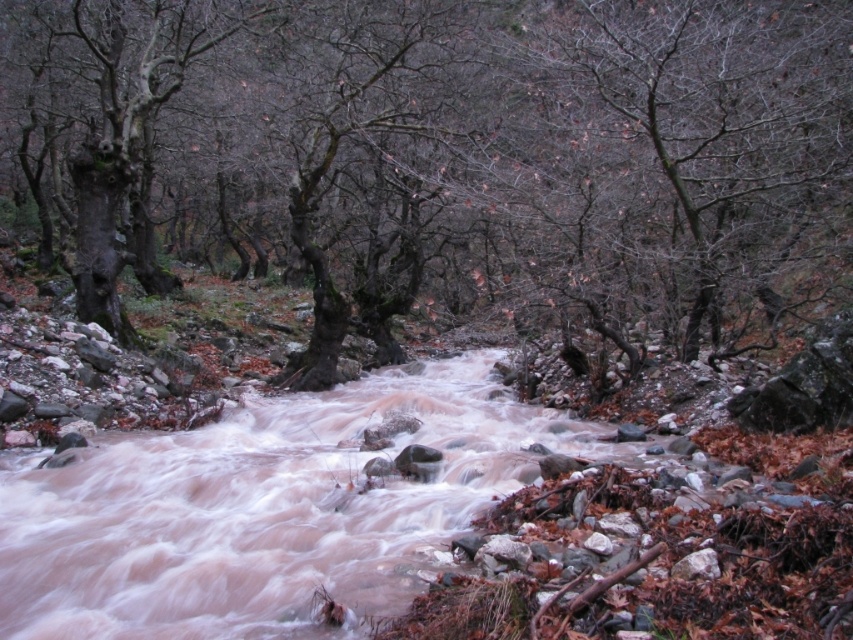
Is smooth bark tree at center closer to the viewer compared to brown/rocky water at center?

That is False.

What do you see at coordinates (447, 154) in the screenshot?
I see `smooth bark tree at center` at bounding box center [447, 154].

I want to click on smooth bark tree at center, so click(x=447, y=154).

In the scene shown: Does brown/rocky water at center have a lesser height compared to smooth bark tree at upper right?

Yes, brown/rocky water at center is shorter than smooth bark tree at upper right.

Who is taller, brown/rocky water at center or smooth bark tree at upper right?

Standing taller between the two is smooth bark tree at upper right.

Between point (134, 625) and point (778, 22), which one is positioned behind?

Point (778, 22)

Where is `brown/rocky water at center`? brown/rocky water at center is located at coordinates coord(263,509).

Is smooth bark tree at center closer to camera compared to dark brown rough bark tree at left?

Yes, smooth bark tree at center is closer to the viewer.

Based on the photo, which is more to the right, smooth bark tree at center or dark brown rough bark tree at left?

From the viewer's perspective, smooth bark tree at center appears more on the right side.

Describe the element at coordinates (447, 154) in the screenshot. The width and height of the screenshot is (853, 640). I see `smooth bark tree at center` at that location.

The width and height of the screenshot is (853, 640). I want to click on smooth bark tree at center, so click(x=447, y=154).